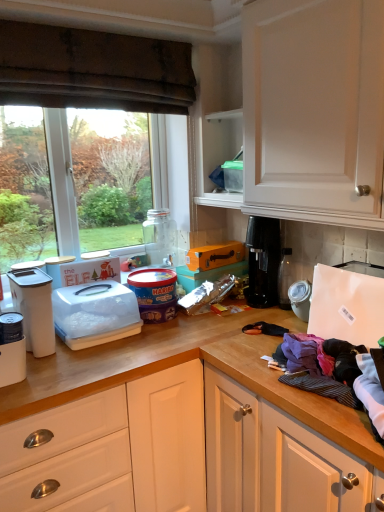
Question: Does purple cotton clothes at lower right, the first clothing in the back-to-front sequence, have a greater height compared to transparent glass window at upper left?

Choices:
 (A) no
 (B) yes

Answer: (A)

Question: Is purple cotton clothes at lower right, the 3th clothing from the front, surrounding transparent glass window at upper left?

Choices:
 (A) yes
 (B) no

Answer: (B)

Question: Is purple cotton clothes at lower right, the first clothing in the back-to-front sequence, next to transparent glass window at upper left?

Choices:
 (A) no
 (B) yes

Answer: (A)

Question: Is purple cotton clothes at lower right, the first clothing in the back-to-front sequence, positioned before transparent glass window at upper left?

Choices:
 (A) no
 (B) yes

Answer: (B)

Question: Is purple cotton clothes at lower right, the 3th clothing from the front, aimed at transparent glass window at upper left?

Choices:
 (A) no
 (B) yes

Answer: (A)

Question: From the image's perspective, relative to transparent glass jar at center, is white plastic container at center-left, which is counted as the 3th appliance, starting from the left, above or below?

Choices:
 (A) below
 (B) above

Answer: (A)

Question: Is white plastic container at center-left, which is the third appliance in right-to-left order, situated inside transparent glass jar at center or outside?

Choices:
 (A) inside
 (B) outside

Answer: (B)

Question: Would you say white plastic container at center-left, which is counted as the 3th appliance, starting from the left, is to the left or to the right of transparent glass jar at center in the picture?

Choices:
 (A) left
 (B) right

Answer: (A)

Question: Looking at the image, does white plastic container at center-left, which is the third appliance in right-to-left order, seem bigger or smaller compared to transparent glass jar at center?

Choices:
 (A) small
 (B) big

Answer: (B)

Question: Considering the positions of point (46, 83) and point (352, 360), is point (46, 83) closer or farther from the camera than point (352, 360)?

Choices:
 (A) closer
 (B) farther

Answer: (B)

Question: Considering their positions, is brown fabric curtain at upper left located in front of or behind purple cotton clothes at right, the 2th clothing when ordered from back to front?

Choices:
 (A) behind
 (B) front

Answer: (A)

Question: In terms of height, does brown fabric curtain at upper left look taller or shorter compared to purple cotton clothes at right, the 2th clothing when ordered from back to front?

Choices:
 (A) tall
 (B) short

Answer: (A)

Question: Do you think brown fabric curtain at upper left is within purple cotton clothes at right, which appears as the second clothing when viewed from the front, or outside of it?

Choices:
 (A) inside
 (B) outside

Answer: (B)

Question: Is black plastic coffee machine at right taller or shorter than transparent glass jar at center?

Choices:
 (A) short
 (B) tall

Answer: (B)

Question: From the image's perspective, relative to transparent glass jar at center, is black plastic coffee machine at right above or below?

Choices:
 (A) below
 (B) above

Answer: (A)